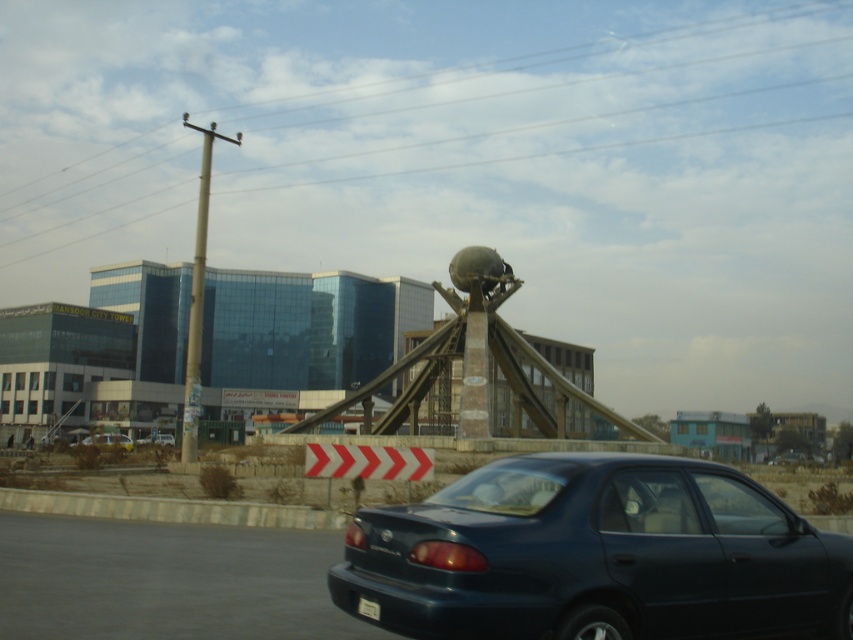
You are standing at the base of the Mansoor City Tower and want to take a photo of the sculpture. There are two points marked on your map at coordinates point (462, 180) and point (508, 268). Which point is closer to you, the photographer?

Point (462, 180) is closer to you because it is further to the camera than point (508, 268), meaning it is nearer in the viewing perspective.

You are standing in front of the MANSOOR CITY TOWER and want to take a photo of the stone globe at center. If your camera can focus on objects up to 150 feet away, will you need to move closer to get a clear shot?

The stone globe at center is 162.27 feet from viewer. Since your camera can focus up to 150 feet, you need to move closer to ensure the stone globe at center is within the focus range.

You are a pedestrian standing on the sidewalk near the road with the metallic blue sedan at center. You want to see the metallic pole at upper center behind the car. Can you see it clearly from your position?

The metallic pole at upper center is above the metallic blue sedan at center, so yes, you can see it clearly from your position as it is positioned higher than the car.